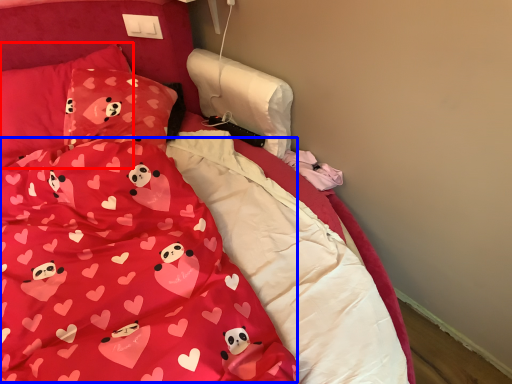
Question: Which of the following is the farthest to the observer, pillow (highlighted by a red box) or blanket (highlighted by a blue box)?

Choices:
 (A) pillow
 (B) blanket

Answer: (A)